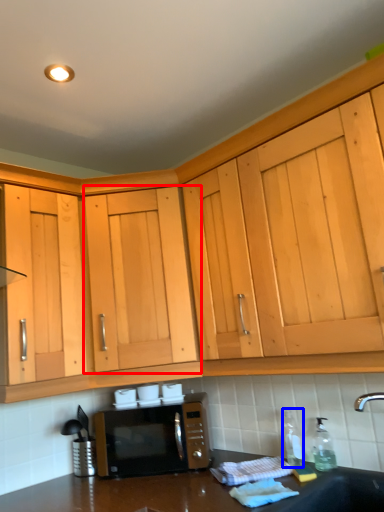
Question: Which object is further to the camera taking this photo, cabinetry (highlighted by a red box) or bottle (highlighted by a blue box)?

Choices:
 (A) cabinetry
 (B) bottle

Answer: (A)